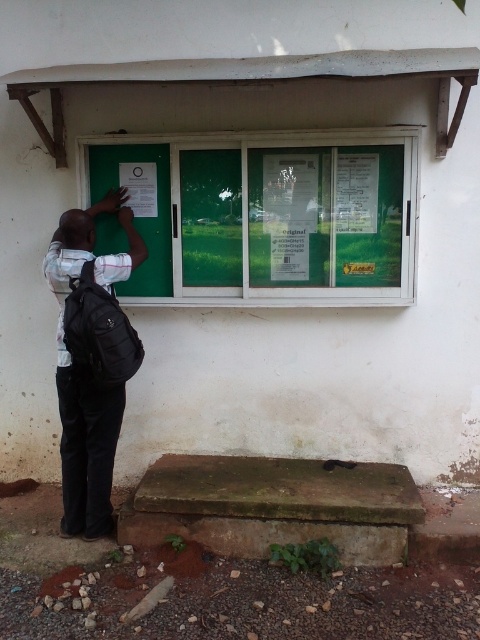
You are a delivery person trying to place a package on the ground near the green glass window at center and the black backpack at left. Which object should you avoid placing the package near to ensure it stays visible and not blocked?

The green glass window at center is shorter than the black backpack at left. To ensure the package stays visible and not blocked, avoid placing it near the black backpack at left since it is taller and could obscure the package.

You are a delivery person standing at the entrance of the building. You need to place a package on the ground near the green glass window at center. The package requires a stable surface. Based on the scene, where should you place the package?

The package should be placed on the concrete step or ledge below the green glass window at center since it provides a stable surface compared to the gravel and vegetation around it.

You are a delivery person trying to place a large package on the ground near the green glass window at center and the black backpack at left. Considering their sizes, which object should you avoid placing the package too close to?

You should avoid placing the package too close to the black backpack at left because the green glass window at center has a smaller size compared to the black backpack at left, meaning the backpack takes up more space and might obstruct access.